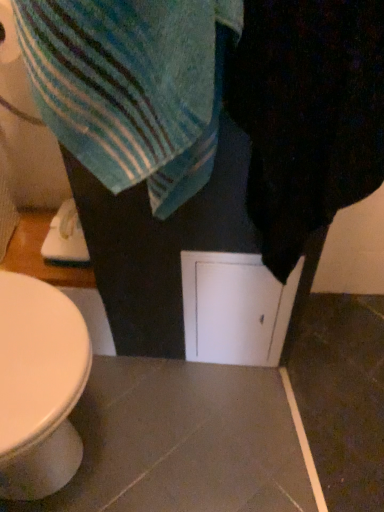
Question: Considering the relative sizes of white matte screen door at center and black fuzzy towel at right in the image provided, is white matte screen door at center shorter than black fuzzy towel at right?

Choices:
 (A) yes
 (B) no

Answer: (A)

Question: From a real-world perspective, is white matte screen door at center over black fuzzy towel at right?

Choices:
 (A) yes
 (B) no

Answer: (B)

Question: Is white matte screen door at center smaller than black fuzzy towel at right?

Choices:
 (A) no
 (B) yes

Answer: (B)

Question: Does white matte screen door at center have a greater width compared to black fuzzy towel at right?

Choices:
 (A) no
 (B) yes

Answer: (A)

Question: Does white matte screen door at center appear on the right side of black fuzzy towel at right?

Choices:
 (A) yes
 (B) no

Answer: (B)

Question: Does white matte screen door at center appear on the left side of black fuzzy towel at right?

Choices:
 (A) yes
 (B) no

Answer: (A)

Question: Can you confirm if black fuzzy towel at right is bigger than blue striped towel at upper left?

Choices:
 (A) yes
 (B) no

Answer: (A)

Question: Would you say black fuzzy towel at right is outside blue striped towel at upper left?

Choices:
 (A) no
 (B) yes

Answer: (B)

Question: Considering the relative sizes of black fuzzy towel at right and blue striped towel at upper left in the image provided, is black fuzzy towel at right shorter than blue striped towel at upper left?

Choices:
 (A) no
 (B) yes

Answer: (A)

Question: From the image's perspective, is black fuzzy towel at right below blue striped towel at upper left?

Choices:
 (A) no
 (B) yes

Answer: (B)

Question: Is black fuzzy towel at right oriented towards blue striped towel at upper left?

Choices:
 (A) no
 (B) yes

Answer: (A)

Question: Is black fuzzy towel at right at the right side of blue striped towel at upper left?

Choices:
 (A) yes
 (B) no

Answer: (A)

Question: Is blue striped towel at upper left facing away from black fuzzy towel at right?

Choices:
 (A) no
 (B) yes

Answer: (A)